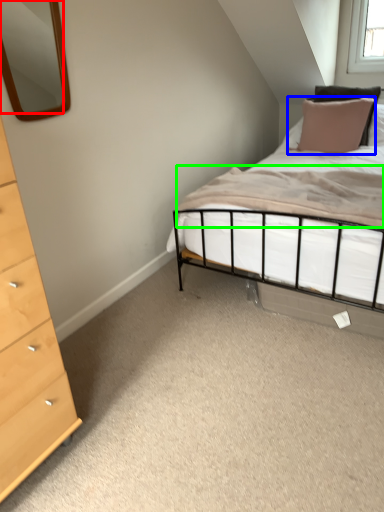
Question: Estimate the real-world distances between objects in this image. Which object is farther from mirror (highlighted by a red box), pillow (highlighted by a blue box) or mattress (highlighted by a green box)?

Choices:
 (A) pillow
 (B) mattress

Answer: (B)